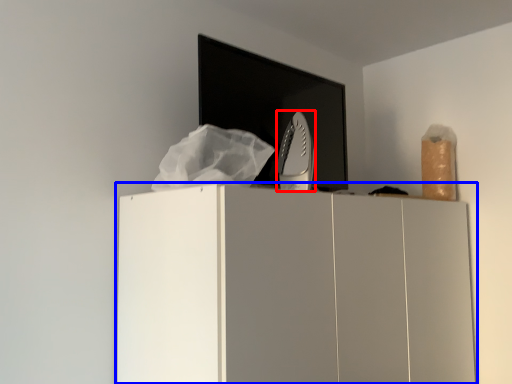
Question: Which of the following is the closest to the observer, home appliance (highlighted by a red box) or cupboard (highlighted by a blue box)?

Choices:
 (A) home appliance
 (B) cupboard

Answer: (B)